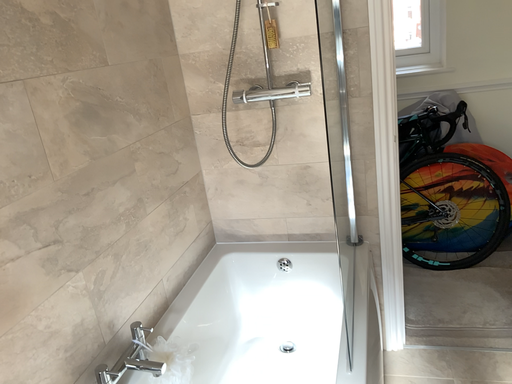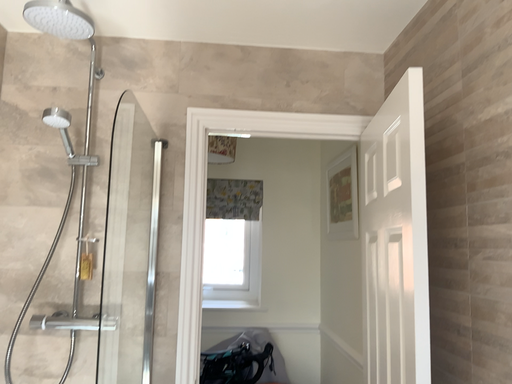
Question: How did the camera likely rotate when shooting the video?

Choices:
 (A) rotated right
 (B) rotated left

Answer: (A)